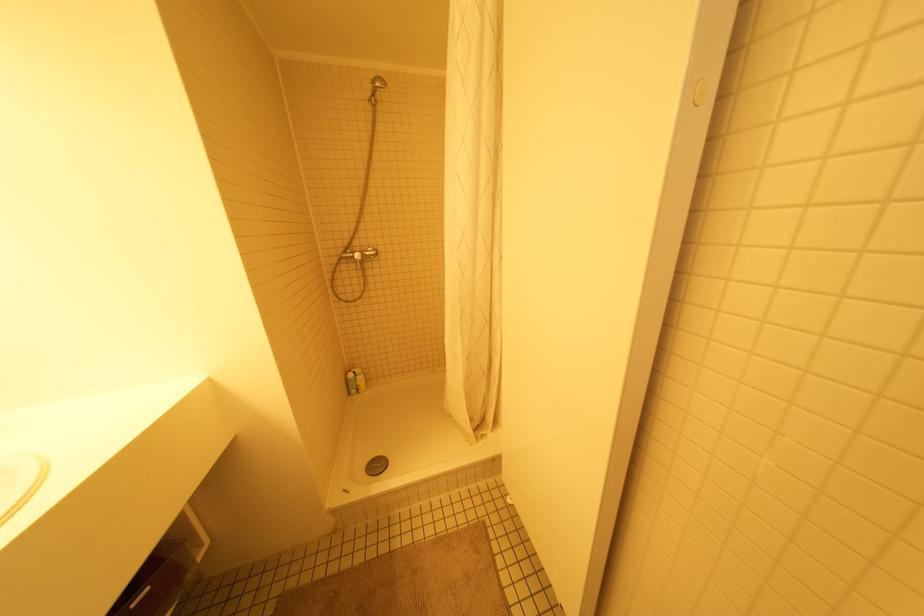
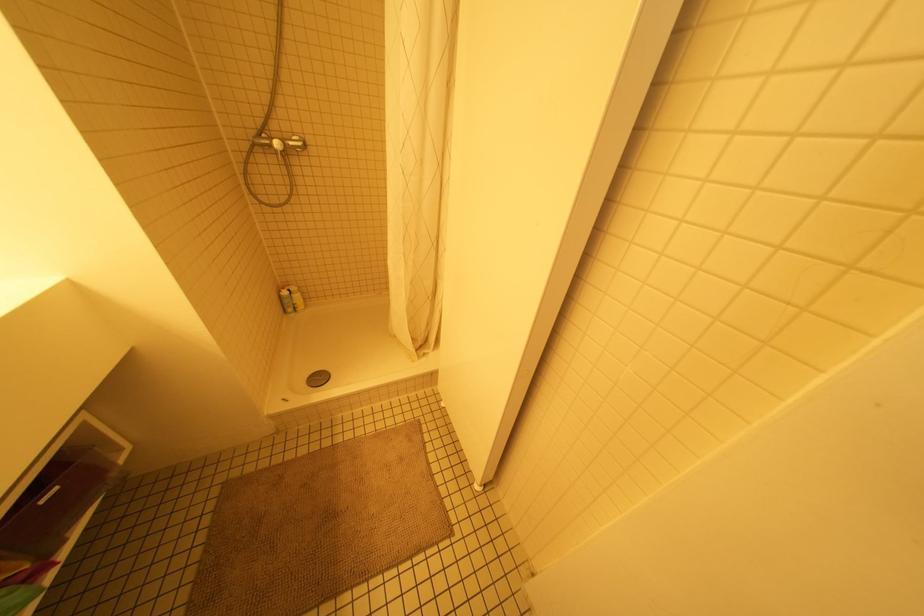
Locate, in the second image, the point that corresponds to (377,466) in the first image.

(319, 378)